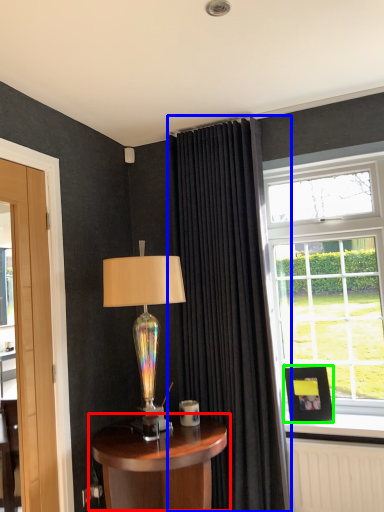
Question: Estimate the real-world distances between objects in this image. Which object is closer to table (highlighted by a red box), curtain (highlighted by a blue box) or picture frame (highlighted by a green box)?

Choices:
 (A) curtain
 (B) picture frame

Answer: (A)